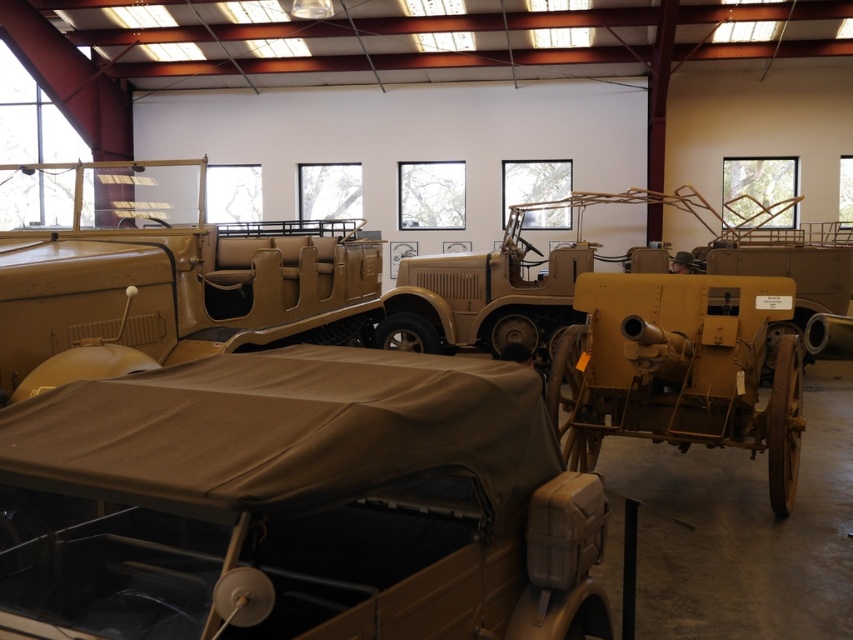
Question: Can you confirm if matte khaki car at center is wider than matte tan jeep at center?

Choices:
 (A) yes
 (B) no

Answer: (B)

Question: Which point appears farthest from the camera in this image?

Choices:
 (A) (577, 593)
 (B) (93, 330)

Answer: (B)

Question: Is matte khaki car at center to the left of matte tan jeep at center from the viewer's perspective?

Choices:
 (A) yes
 (B) no

Answer: (B)

Question: Can you confirm if matte khaki car at center is smaller than matte tan jeep at center?

Choices:
 (A) no
 (B) yes

Answer: (B)

Question: Which object appears farthest from the camera in this image?

Choices:
 (A) matte tan jeep at center
 (B) matte khaki car at center

Answer: (A)

Question: Which point appears closest to the camera in this image?

Choices:
 (A) (302, 616)
 (B) (78, 163)

Answer: (A)